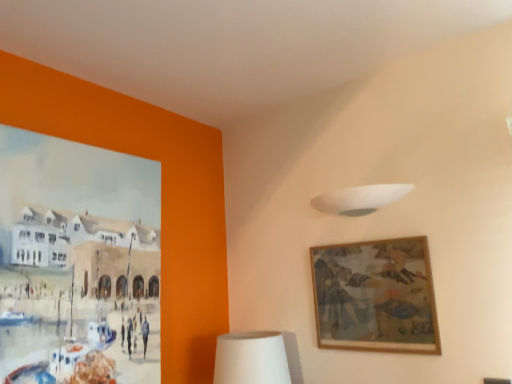
Question: Can you confirm if white matte lampshade at upper center is thinner than white matte table lamp at lower center?

Choices:
 (A) no
 (B) yes

Answer: (B)

Question: Could white matte table lamp at lower center be considered to be inside white matte lampshade at upper center?

Choices:
 (A) no
 (B) yes

Answer: (A)

Question: Is white matte lampshade at upper center beside white matte table lamp at lower center?

Choices:
 (A) no
 (B) yes

Answer: (A)

Question: From a real-world perspective, is white matte lampshade at upper center on top of white matte table lamp at lower center?

Choices:
 (A) yes
 (B) no

Answer: (A)

Question: From the image's perspective, is white matte lampshade at upper center under white matte table lamp at lower center?

Choices:
 (A) no
 (B) yes

Answer: (A)

Question: Choose the correct answer: Is white matte table lamp at lower center inside wooden framed artwork at upper right or outside it?

Choices:
 (A) outside
 (B) inside

Answer: (A)

Question: Is white matte table lamp at lower center wider or thinner than wooden framed artwork at upper right?

Choices:
 (A) thin
 (B) wide

Answer: (B)

Question: In terms of height, does white matte table lamp at lower center look taller or shorter compared to wooden framed artwork at upper right?

Choices:
 (A) tall
 (B) short

Answer: (B)

Question: From a real-world perspective, is white matte table lamp at lower center physically located above or below wooden framed artwork at upper right?

Choices:
 (A) above
 (B) below

Answer: (B)

Question: From a real-world perspective, is white matte lampshade at upper center positioned above or below white matte table lamp at lower center?

Choices:
 (A) above
 (B) below

Answer: (A)

Question: In the image, is white matte lampshade at upper center on the left side or the right side of white matte table lamp at lower center?

Choices:
 (A) left
 (B) right

Answer: (B)

Question: From the image's perspective, relative to white matte table lamp at lower center, is white matte lampshade at upper center above or below?

Choices:
 (A) above
 (B) below

Answer: (A)

Question: In terms of width, does white matte lampshade at upper center look wider or thinner when compared to white matte table lamp at lower center?

Choices:
 (A) thin
 (B) wide

Answer: (A)

Question: Is point [x=366, y=213] closer or farther from the camera than point [x=418, y=314]?

Choices:
 (A) farther
 (B) closer

Answer: (A)

Question: Is white matte lampshade at upper center wider or thinner than wooden framed artwork at upper right?

Choices:
 (A) thin
 (B) wide

Answer: (B)